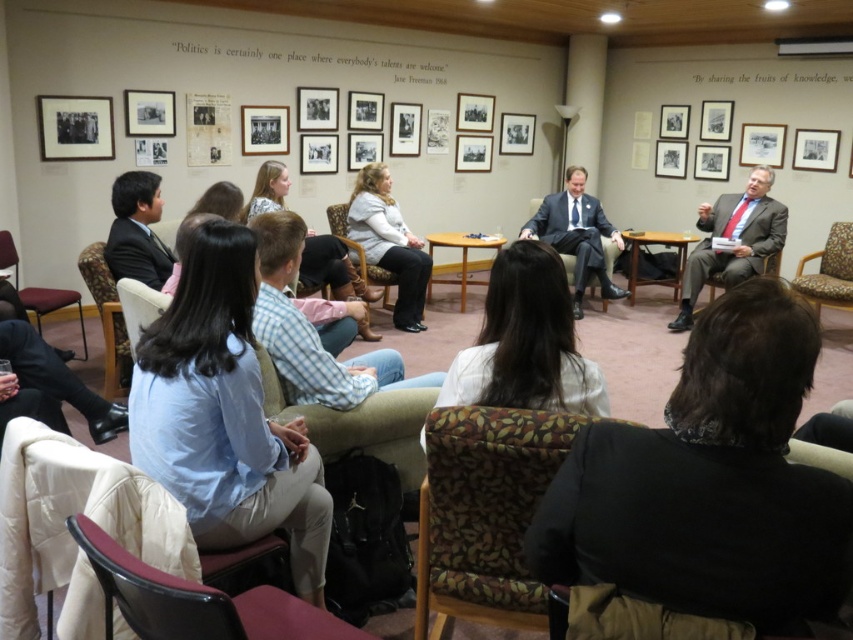
Who is shorter, black leather armchair at lower left or matte gray suit at right?

black leather armchair at lower left is shorter.

Can you confirm if black leather armchair at lower left is shorter than matte gray suit at right?

Yes.

Which is in front, point (183, 621) or point (761, 236)?

Point (183, 621) is more forward.

Identify the location of black leather armchair at lower left. (195, 600).

Can you confirm if light gray sweater at center is taller than light brown wooden table at center?

Yes, light gray sweater at center is taller than light brown wooden table at center.

What do you see at coordinates (389, 243) in the screenshot? I see `light gray sweater at center` at bounding box center [389, 243].

Identify the location of light gray sweater at center. (389, 243).

Locate an element on the screen. Image resolution: width=853 pixels, height=640 pixels. light gray sweater at center is located at coordinates (389, 243).

Can you confirm if light brown wooden table at center is thinner than dark brown leather armchair at right?

Incorrect, light brown wooden table at center's width is not less than dark brown leather armchair at right's.

Describe the element at coordinates (461, 257) in the screenshot. I see `light brown wooden table at center` at that location.

I want to click on light brown wooden table at center, so click(x=461, y=257).